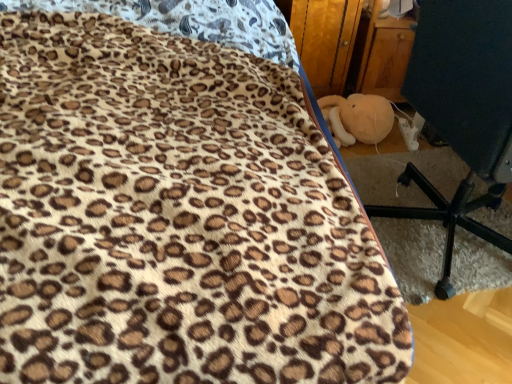
Question: Is black plastic chair at lower right looking in the opposite direction of soft plush toy at lower right?

Choices:
 (A) yes
 (B) no

Answer: (B)

Question: Is black plastic chair at lower right wider than soft plush toy at lower right?

Choices:
 (A) yes
 (B) no

Answer: (A)

Question: From the image's perspective, is black plastic chair at lower right beneath soft plush toy at lower right?

Choices:
 (A) yes
 (B) no

Answer: (A)

Question: Does black plastic chair at lower right have a lesser height compared to soft plush toy at lower right?

Choices:
 (A) no
 (B) yes

Answer: (A)

Question: Does black plastic chair at lower right lie behind soft plush toy at lower right?

Choices:
 (A) no
 (B) yes

Answer: (A)

Question: In terms of size, does wooden at right appear bigger or smaller than soft plush toy at lower right?

Choices:
 (A) small
 (B) big

Answer: (B)

Question: Considering the positions of point (361, 0) and point (389, 117), is point (361, 0) closer or farther from the camera than point (389, 117)?

Choices:
 (A) closer
 (B) farther

Answer: (A)

Question: Considering the positions of wooden at right and soft plush toy at lower right in the image, is wooden at right wider or thinner than soft plush toy at lower right?

Choices:
 (A) wide
 (B) thin

Answer: (A)

Question: Based on their positions, is wooden at right located to the left or right of soft plush toy at lower right?

Choices:
 (A) left
 (B) right

Answer: (A)

Question: Considering the relative positions of soft plush toy at lower right and black plastic chair at lower right in the image provided, is soft plush toy at lower right to the left or to the right of black plastic chair at lower right?

Choices:
 (A) right
 (B) left

Answer: (B)

Question: From the image's perspective, is soft plush toy at lower right positioned above or below black plastic chair at lower right?

Choices:
 (A) below
 (B) above

Answer: (B)

Question: Looking at their shapes, would you say soft plush toy at lower right is wider or thinner than black plastic chair at lower right?

Choices:
 (A) wide
 (B) thin

Answer: (B)

Question: In terms of height, does soft plush toy at lower right look taller or shorter compared to black plastic chair at lower right?

Choices:
 (A) short
 (B) tall

Answer: (A)

Question: Does point (453, 122) appear closer or farther from the camera than point (330, 51)?

Choices:
 (A) closer
 (B) farther

Answer: (A)

Question: Is black plastic chair at lower right inside or outside of wooden at right?

Choices:
 (A) inside
 (B) outside

Answer: (B)